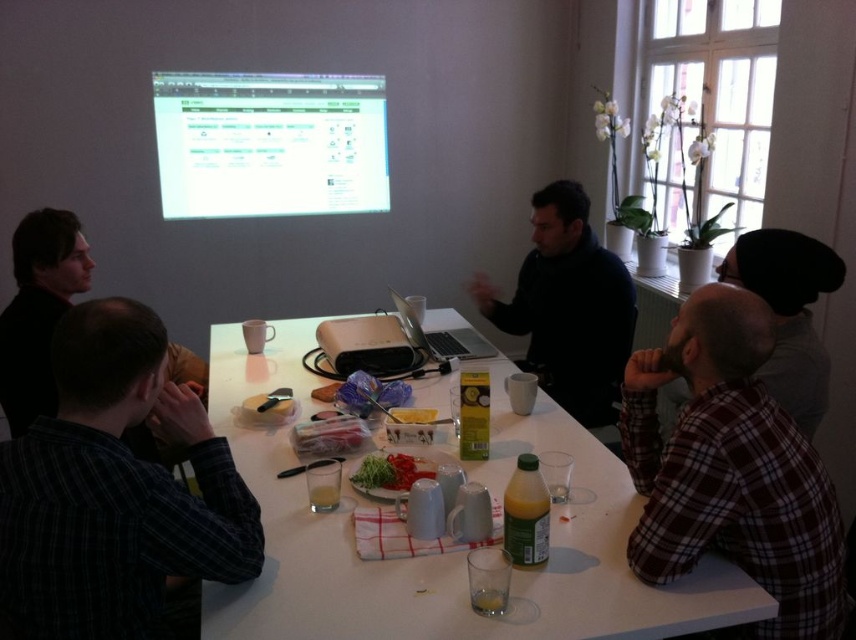
You are sitting at the rectangular white table and want to present a slide from the white glossy projection screen at upper center using the silver metallic laptop at center. Which direction should you move the laptop to align it with the screen?

The white glossy projection screen at upper center is to the left of the silver metallic laptop at center, so you should move the laptop to the left to align it with the screen.

You are standing at the center of the table and want to pass an item to the person wearing the dark plaid shirt at lower left. In which direction should you move to reach them?

→ The dark plaid shirt at lower left is located at point [116,490], so you should move towards the lower left direction to reach them.